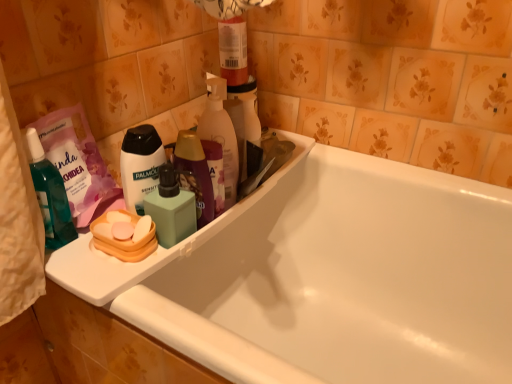
The width and height of the screenshot is (512, 384). Find the location of `vacant region in front of orange plastic soap at left, positioned as the 2th personal care in top-to-bottom order`. vacant region in front of orange plastic soap at left, positioned as the 2th personal care in top-to-bottom order is located at coordinates (120, 284).